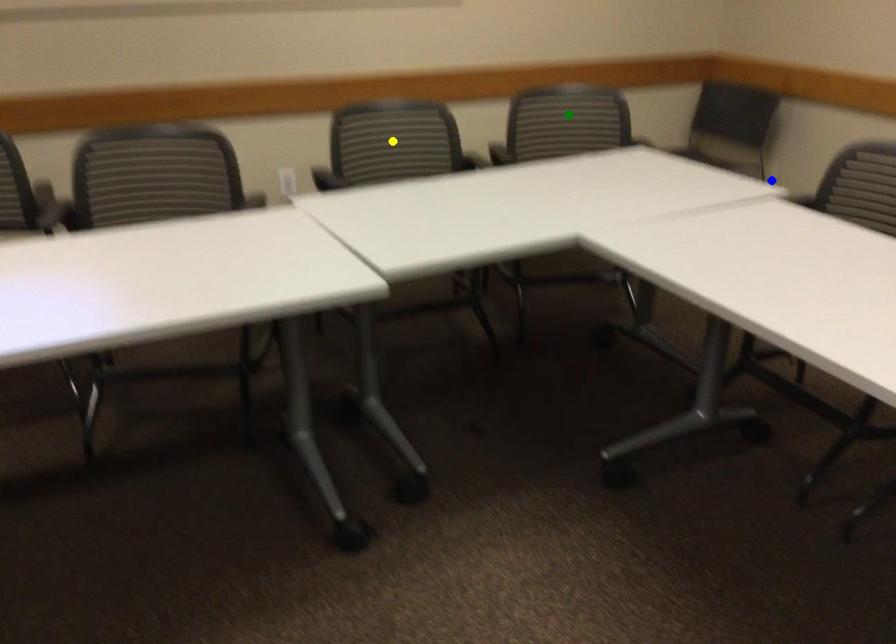
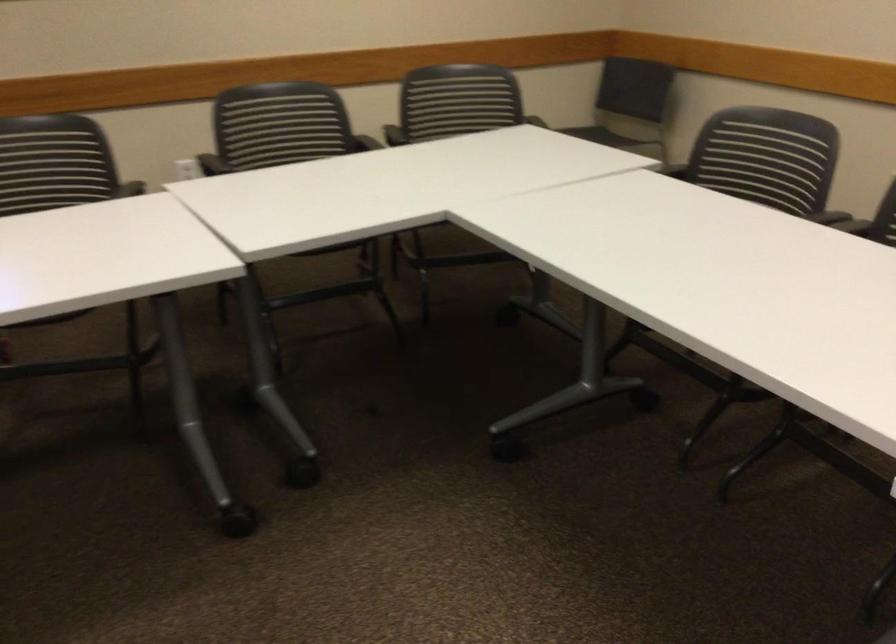
I am providing you with two images of the same scene from different viewpoints. Three points are marked in image1. Which point corresponds to a part or object that is occluded in image2?In image1, three points are marked. Which of them correspond to a part or object that is occluded in image2?Among the three points shown in image1, which one corresponds to a part or object that is no longer visible due to occlusion in image2?

yellow point, green point cannot be seen in image2.